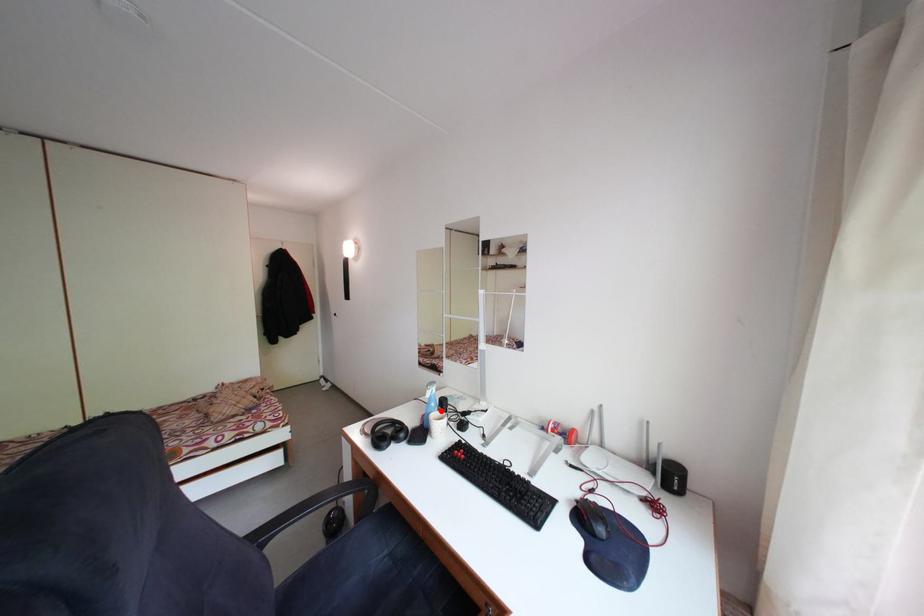
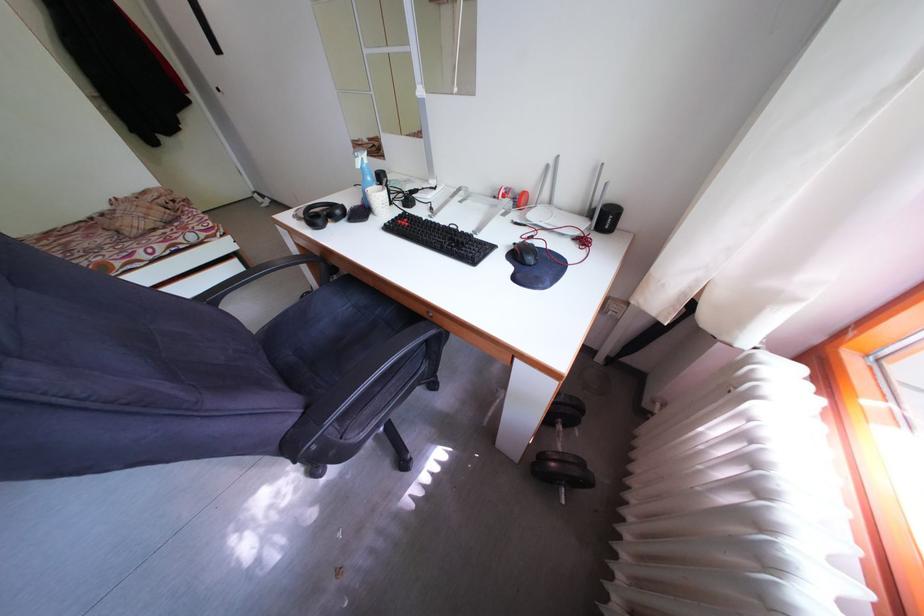
The point at the highlighted location is marked in the first image. Where is the corresponding point in the second image?

(378, 185)